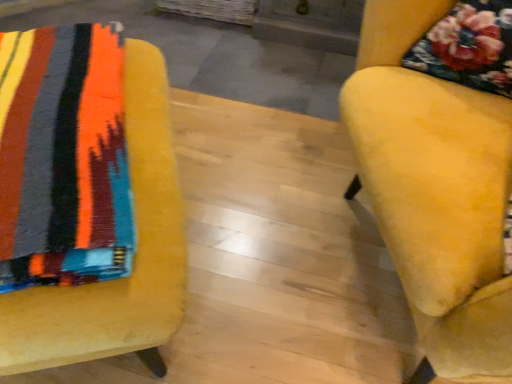
Locate an element on the screen. The width and height of the screenshot is (512, 384). vacant space that is to the left of velvet yellow chair at right, which is the 1th chair in right-to-left order is located at coordinates (255, 255).